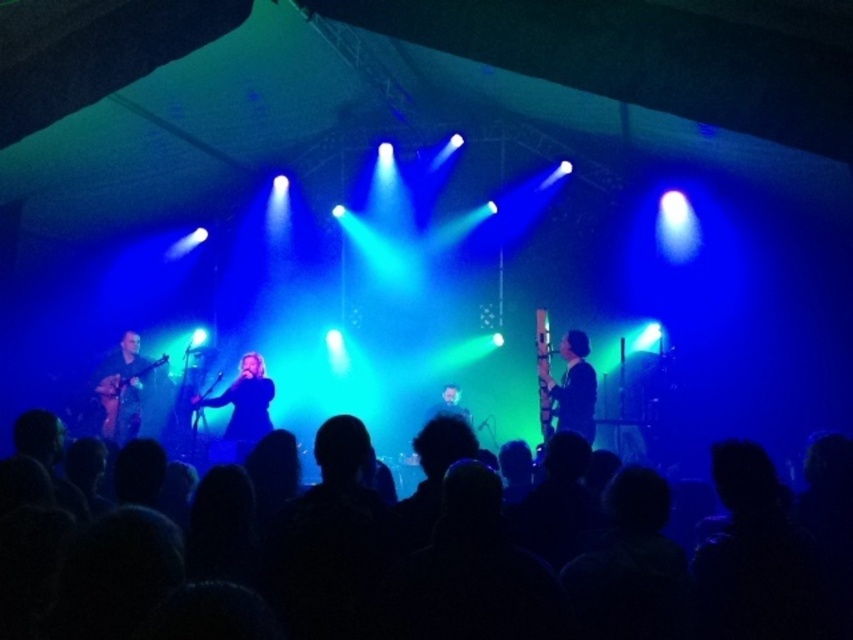
You are a stagehand who needs to move a 15 feet long extension cord from the shiny brown guitar at left to the black silhouettes at lower center. Can you place the cord between them without bending it?

The distance between the black silhouettes at lower center and the shiny brown guitar at left is 20.63 feet. Since the extension cord is only 15 feet long, it is not long enough to reach between them without bending.

Based on the photo, you are a photographer capturing the live music performance. You want to focus on the musician closest to the camera. Which point, point (151, 557) or point (123, 392), should you aim your camera at?

Point (151, 557) is closer to the camera than point (123, 392), so you should aim your camera at point (151, 557) to focus on the musician closest to the camera.

You are a photographer standing at the camera position. You want to capture a closeup shot of the black matte shirt at center. Considering the distance, can you get a clear closeup without moving closer?

The black matte shirt at center is 19.79 feet away from camera. Since 19.79 feet is a considerable distance, you would need a telephoto lens to capture a clear closeup without moving closer.